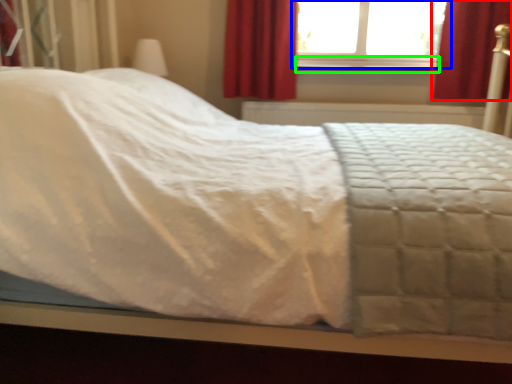
Question: Based on their relative distances, which object is farther from curtain (highlighted by a red box)? Choose from window (highlighted by a blue box) and window sill (highlighted by a green box).

Choices:
 (A) window
 (B) window sill

Answer: (A)